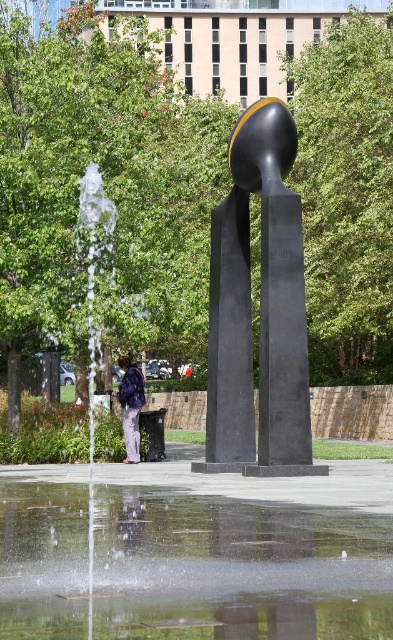
You are standing in the urban setting and want to take a photo of the glistening water at fountain center without getting your shoes wet. The water pool around the fountain is 2 meters in diameter. What is the minimum distance you should maintain from the fountain to stay dry?

The glistening water at fountain center and viewer are 4.96 meters apart. Since the water pool is 2 meters in diameter, the radius is 1 meter. To stay dry, you should stand at least 1 meter away from the edge of the pool. Therefore, the minimum distance from the fountain center would be 1 meter plus the 1 meter radius, totaling 2 meters. However, since you are already 4.96 meters away, you are safely out of the water area.

You are a photographer planning to capture the glistening water at fountain center and the black polished stone sculpture at center. Which object appears taller in the photo?

The black polished stone sculpture at center is taller than the glistening water at fountain center, so it will appear taller in the photo.

You are standing at the center of the sculpture and want to walk to the glistening water at fountain center. Which direction should you go?

You should walk towards the direction of the glistening water at fountain center located at point (238,568).